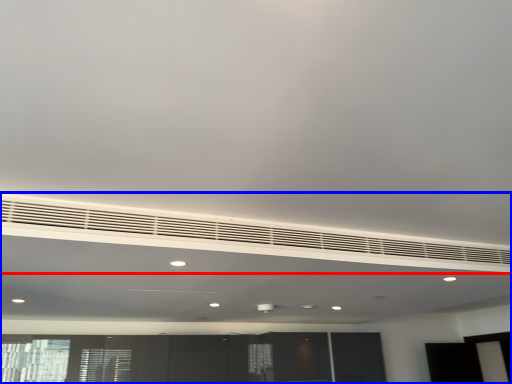
Question: Which object is further to the camera taking this photo, air conditioning (highlighted by a red box) or entertainment center (highlighted by a blue box)?

Choices:
 (A) air conditioning
 (B) entertainment center

Answer: (A)